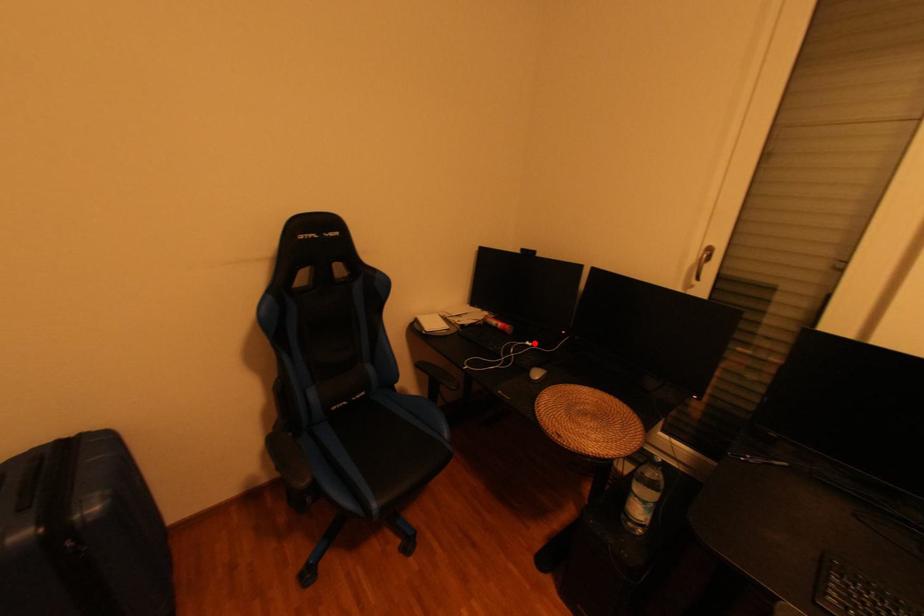
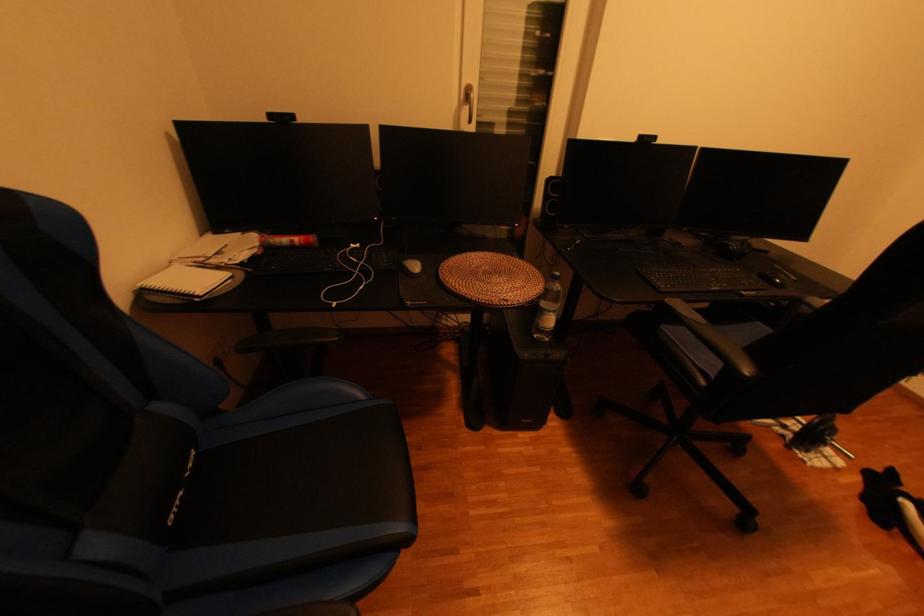
In the second image, find the point that corresponds to the highlighted location in the first image.

(359, 246)